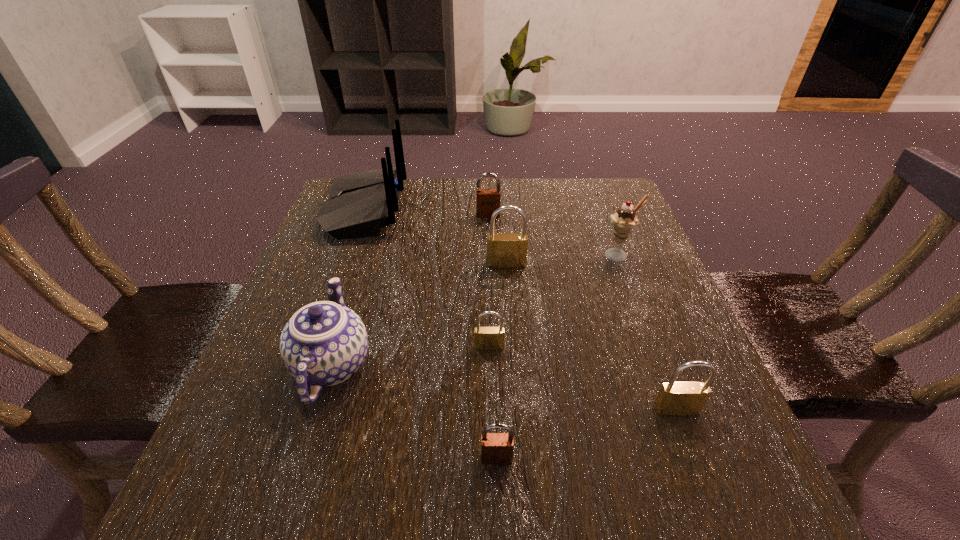
The height and width of the screenshot is (540, 960). What are the coordinates of `brass padlock that is the closest to the chinaware` in the screenshot? It's located at (486, 338).

The height and width of the screenshot is (540, 960). I want to click on the second closest brass padlock to the chinaware, so click(x=504, y=250).

Locate an element on the screen. This screenshot has height=540, width=960. free space that satisfies the following two spatial constraints: 1. on the back of the tallest object; 2. at the spout of the chinaware is located at coordinates (309, 364).

Locate an element on the screen. This screenshot has height=540, width=960. vacant area in the image that satisfies the following two spatial constraints: 1. on the back side of the icecream; 2. on the back of the router is located at coordinates (601, 210).

Locate an element on the screen. vacant region that satisfies the following two spatial constraints: 1. at the spout of the icecream; 2. on the left side of the blue chinaware is located at coordinates (367, 255).